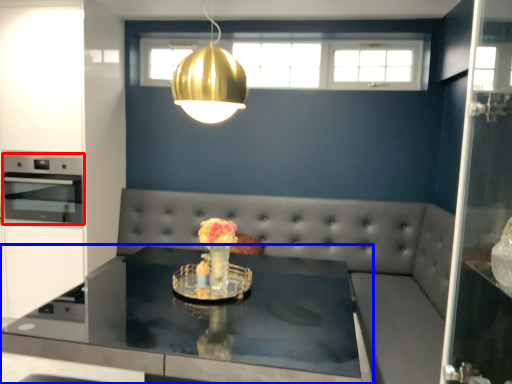
Question: Which of the following is the farthest to the observer, appliance (highlighted by a red box) or table (highlighted by a blue box)?

Choices:
 (A) appliance
 (B) table

Answer: (A)